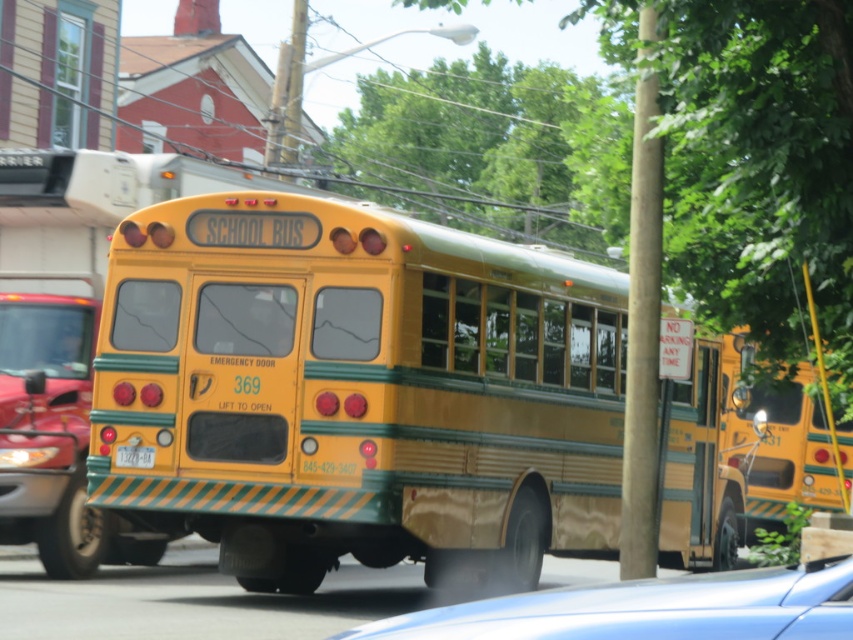
Does yellow/golden metallic school bus at center come in front of metallic blue car at lower center?

No, it is behind metallic blue car at lower center.

Can you confirm if yellow/golden metallic school bus at center is wider than metallic blue car at lower center?

Incorrect, yellow/golden metallic school bus at center's width does not surpass metallic blue car at lower center's.

Who is more distant from viewer, (111,380) or (376,634)?

Positioned behind is point (111,380).

Where is `yellow/golden metallic school bus at center`? yellow/golden metallic school bus at center is located at coordinates (357, 390).

Does yellow/golden metallic school bus at center have a greater width compared to matte black bus at left?

No.

Can you confirm if yellow/golden metallic school bus at center is positioned to the left of matte black bus at left?

Incorrect, yellow/golden metallic school bus at center is not on the left side of matte black bus at left.

Is point (422, 522) positioned behind point (10, 472)?

No.

The image size is (853, 640). In order to click on yellow/golden metallic school bus at center in this screenshot , I will do click(x=357, y=390).

Can you confirm if matte black bus at left is positioned above metallic blue car at lower center?

Actually, matte black bus at left is below metallic blue car at lower center.

In the scene shown: Is matte black bus at left shorter than metallic blue car at lower center?

In fact, matte black bus at left may be taller than metallic blue car at lower center.

At what (x,y) coordinates should I click in order to perform the action: click on matte black bus at left. Please return your answer as a coordinate pair (x, y). This screenshot has height=640, width=853. Looking at the image, I should click on (53, 436).